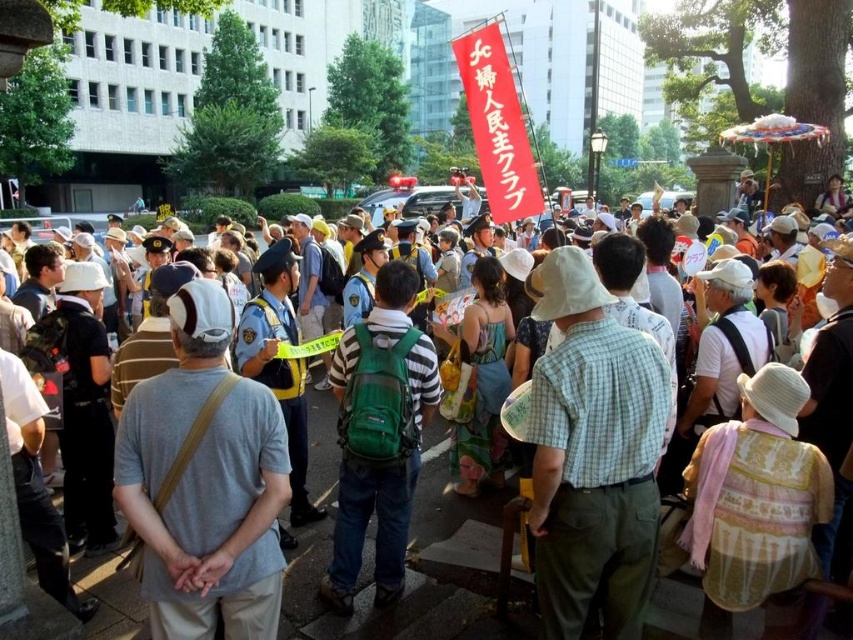
You are part of a crowd at an event and notice a green backpack at center and a blue floral dress at center. Which item is positioned more to the left?

The green backpack at center is positioned more to the left than the blue floral dress at center.

You are organizing a photo shoot and need to ensure that two models wearing the gray fabric shirt at center and the blue floral dress at center can stand side by side without overlapping. Based on the scene description, can you determine if there is enough space between them?

The gray fabric shirt at center might be wider than blue floral dress at center, so there is insufficient information to determine if they can stand side by side without overlapping. More details about their actual widths are needed.